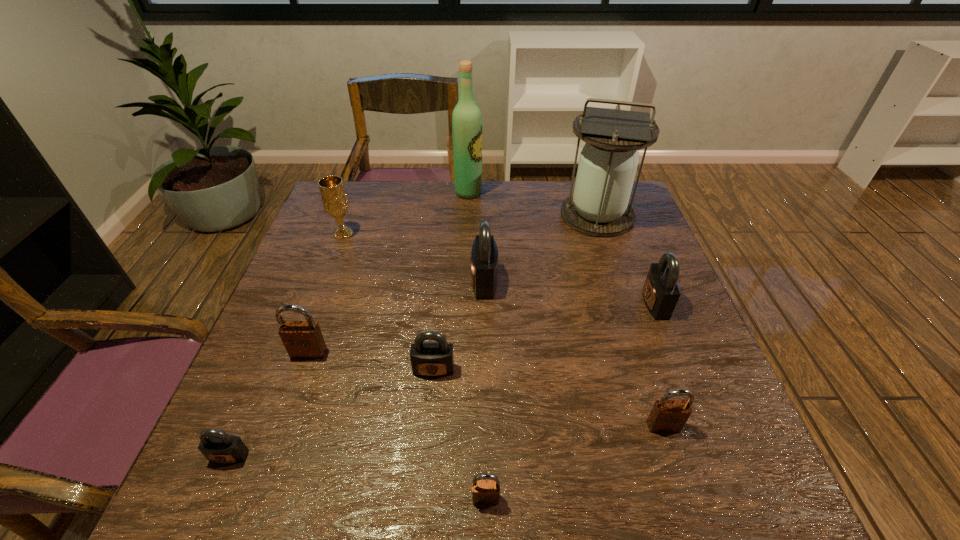
I want to click on the fifth farthest padlock, so click(667, 416).

At what (x,y) coordinates should I click in order to perform the action: click on the third gray padlock from right to left. Please return your answer as a coordinate pair (x, y). Looking at the image, I should click on click(428, 359).

Find the location of a particular element. The height and width of the screenshot is (540, 960). the third biggest gray padlock is located at coordinates (428, 359).

Find the location of `the ninth farthest object`. the ninth farthest object is located at coordinates (217, 446).

Where is `the leftmost padlock`? the leftmost padlock is located at coordinates coord(217,446).

At what (x,y) coordinates should I click in order to perform the action: click on the nearest brown padlock. Please return your answer as a coordinate pair (x, y). This screenshot has width=960, height=540. Looking at the image, I should click on [x=484, y=492].

Where is `the nearest object`? the nearest object is located at coordinates (484, 492).

Identify the location of vacant space located 0.080m on the front-facing side of the wine bottle. The width and height of the screenshot is (960, 540). (507, 193).

Identify the location of free spot located on the left of the second tallest object. (458, 215).

Locate an element on the screen. The width and height of the screenshot is (960, 540). vacant area located 0.110m on the front of the tallest padlock near the keyhole is located at coordinates (427, 282).